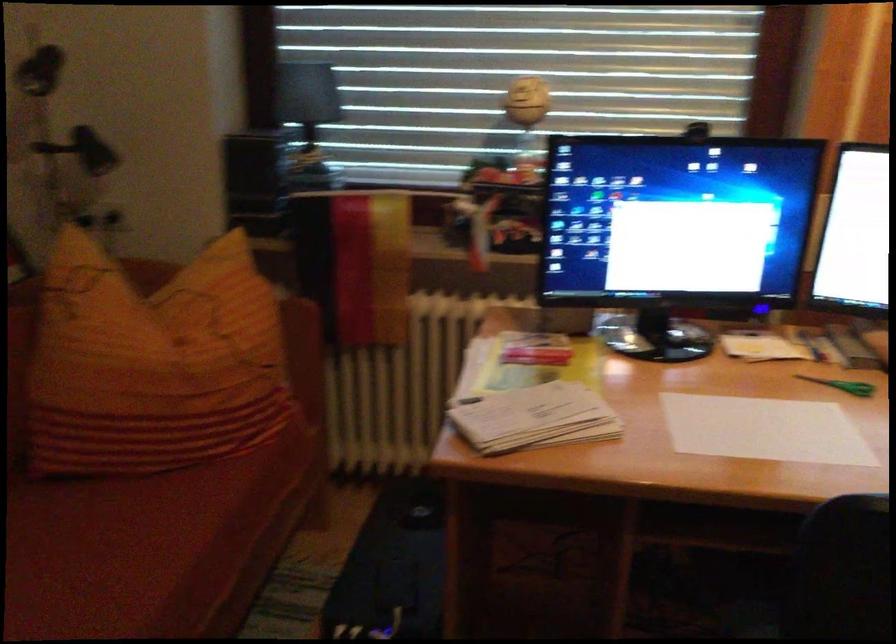
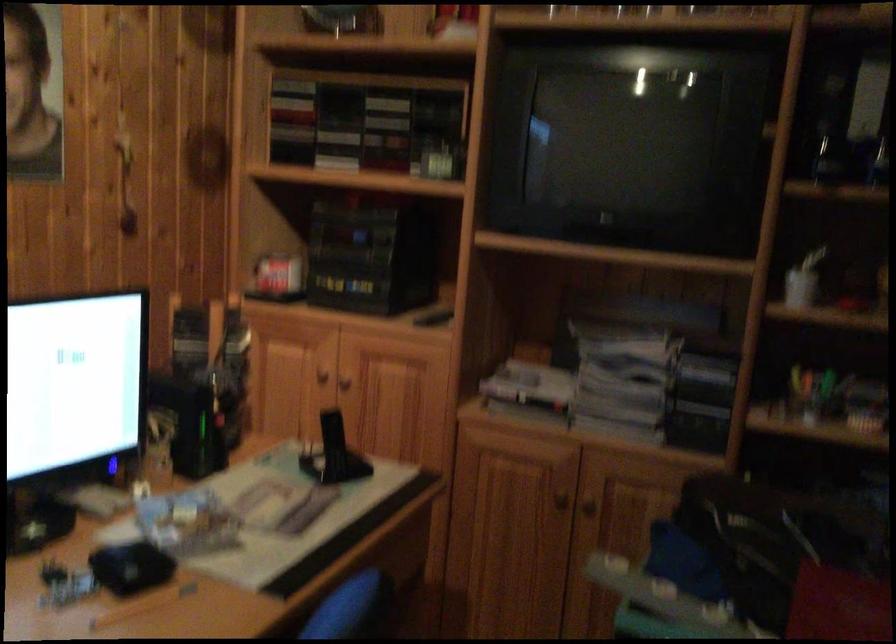
Question: The camera is either moving clockwise (left) or counter-clockwise (right) around the object. The first image is from the beginning of the video and the second image is from the end. Is the camera moving left or right when shooting the video?

Choices:
 (A) Left
 (B) Right

Answer: (A)